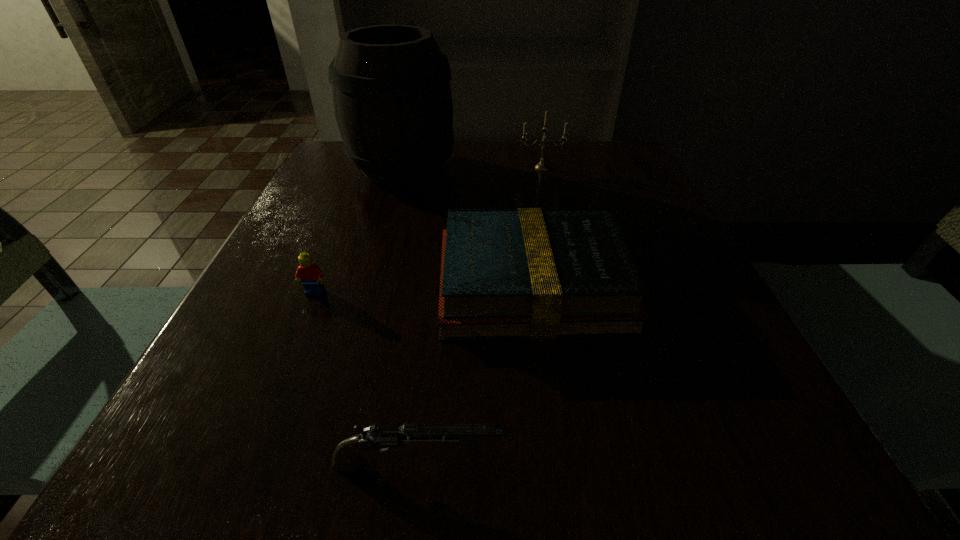
Locate an element on the screen. blank space at the right edge of the desktop is located at coordinates (647, 334).

Image resolution: width=960 pixels, height=540 pixels. Identify the location of vacant region at the far left corner. (342, 172).

Identify the location of empty space between the fourth shortest object and the tallest object. (472, 168).

Image resolution: width=960 pixels, height=540 pixels. Find the location of `free space between the Lego and the hardback book`. free space between the Lego and the hardback book is located at coordinates (423, 289).

Where is `vacant space that's between the Lego and the tallest object`? The height and width of the screenshot is (540, 960). vacant space that's between the Lego and the tallest object is located at coordinates (359, 232).

I want to click on free spot between the Lego and the candle, so click(428, 231).

Locate an element on the screen. empty space between the Lego and the wine bucket is located at coordinates (359, 232).

Point out which object is positioned as the nearest to the candle. Please provide its 2D coordinates. Your answer should be formatted as a tuple, i.e. [(x, y)], where the tuple contains the x and y coordinates of a point satisfying the conditions above.

[(392, 99)]

At what (x,y) coordinates should I click in order to perform the action: click on object that stands as the closest to the wine bucket. Please return your answer as a coordinate pair (x, y). This screenshot has height=540, width=960. Looking at the image, I should click on (541, 166).

Where is `free spot that satisfies the following two spatial constraints: 1. on the back side of the second tallest object; 2. on the right side of the tallest object`? free spot that satisfies the following two spatial constraints: 1. on the back side of the second tallest object; 2. on the right side of the tallest object is located at coordinates (403, 167).